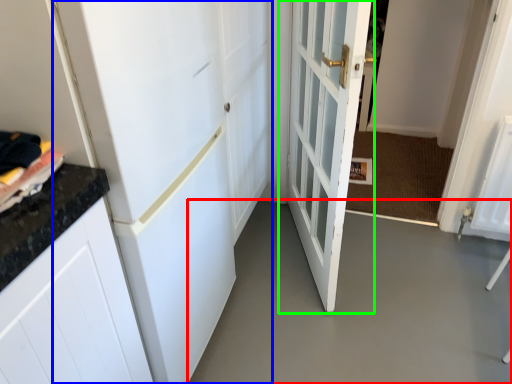
Question: Which is nearer to the concrete (highlighted by a red box)? door (highlighted by a blue box) or door (highlighted by a green box).

Choices:
 (A) door
 (B) door

Answer: (B)